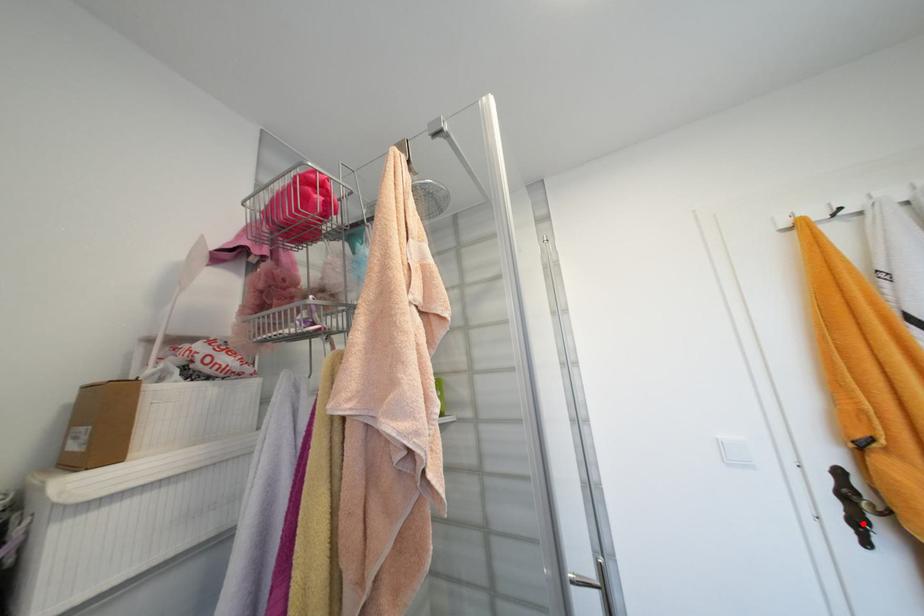
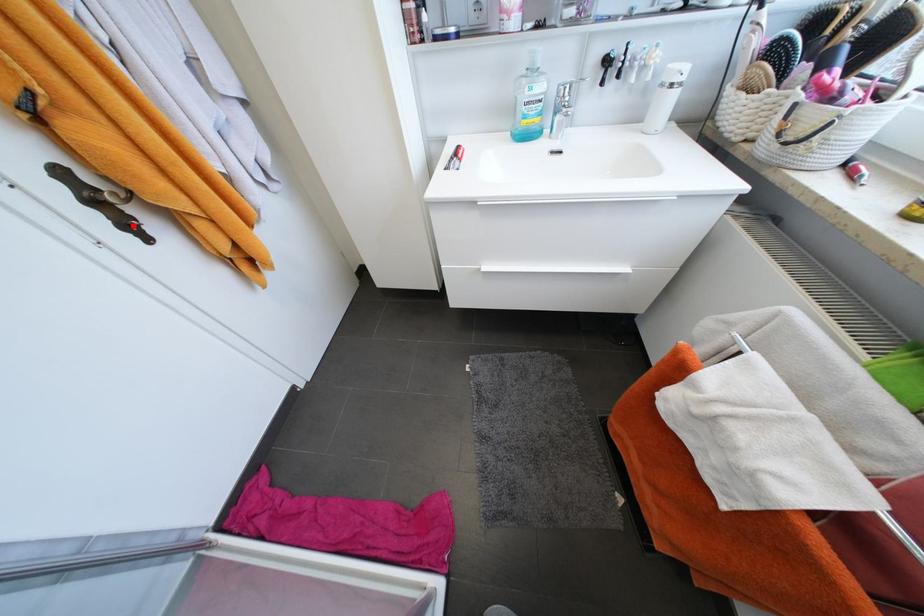
I am providing you with two images of the same scene from different viewpoints. A red point is marked on the first image and another point is marked on the second image. Are the points marked in image1 and image2 representing the same 3D position?

Yes